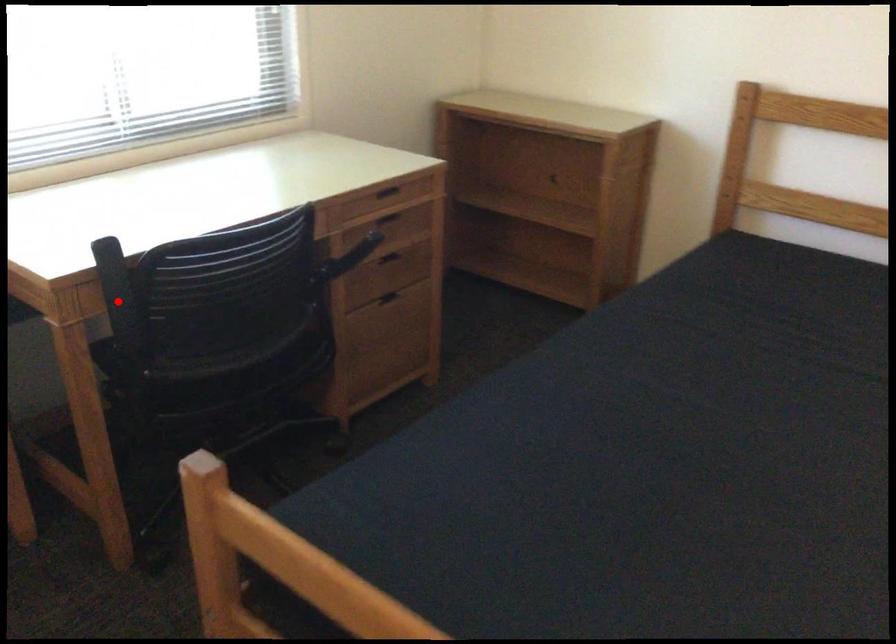
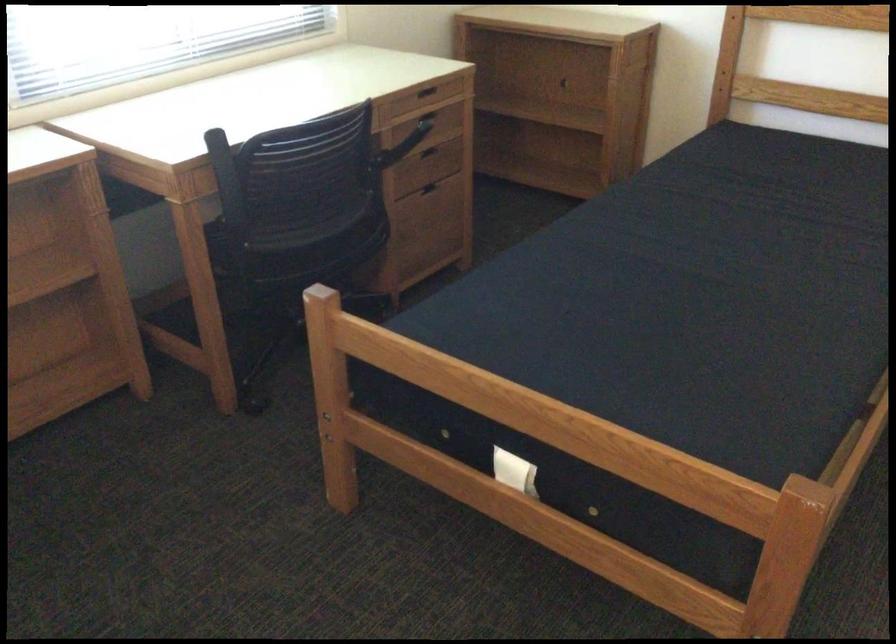
Question: I am providing you with two images of the same scene from different viewpoints. A red point is shown in image1. For the corresponding object point in image2, is it positioned nearer or farther from the camera?

Choices:
 (A) Nearer
 (B) Farther

Answer: (B)